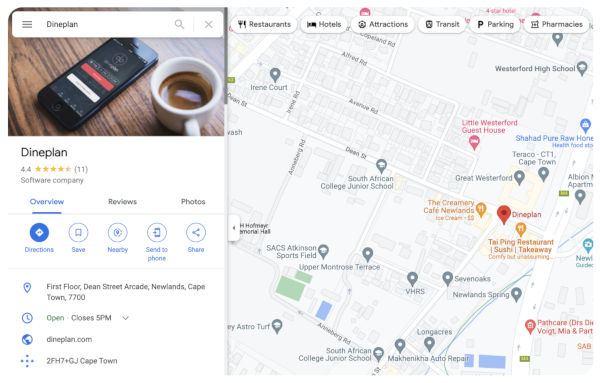
Where is `phone`? phone is located at coordinates [x=97, y=58].